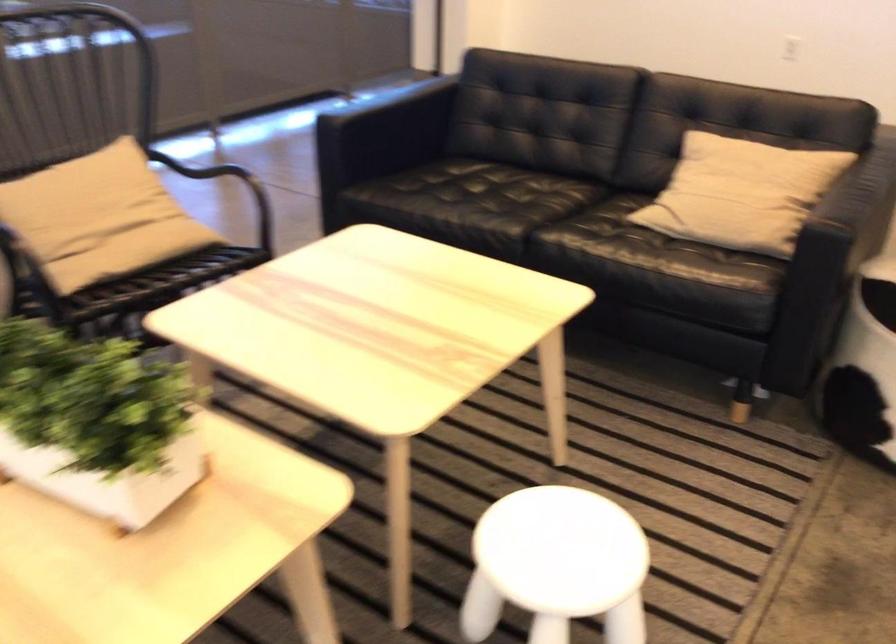
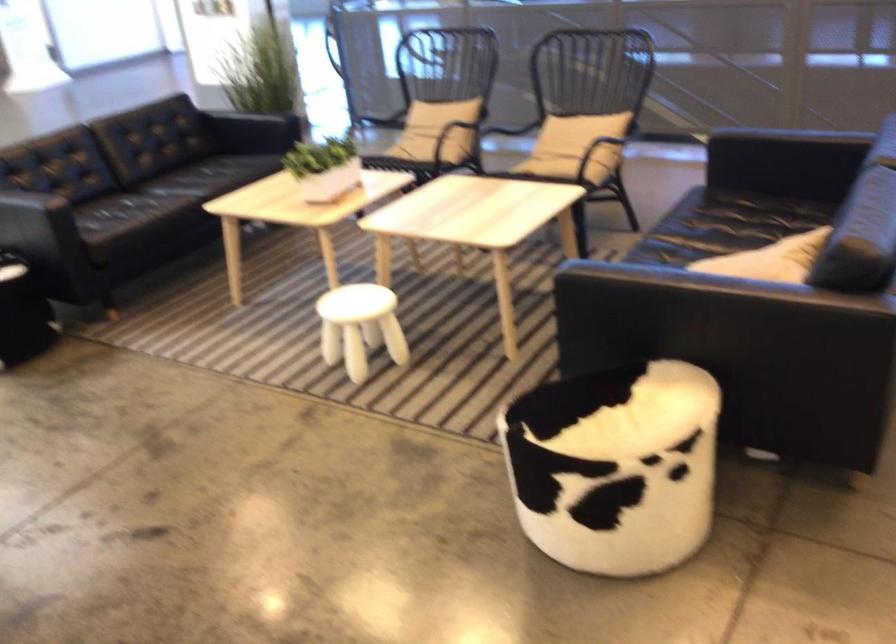
Locate, in the second image, the point that corresponds to pixel 126 404 in the first image.

(323, 167)